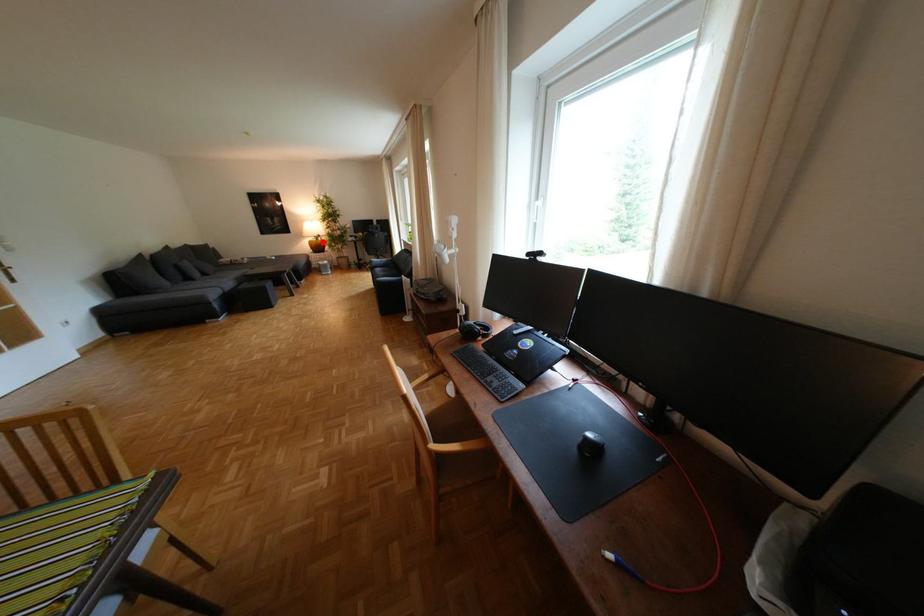
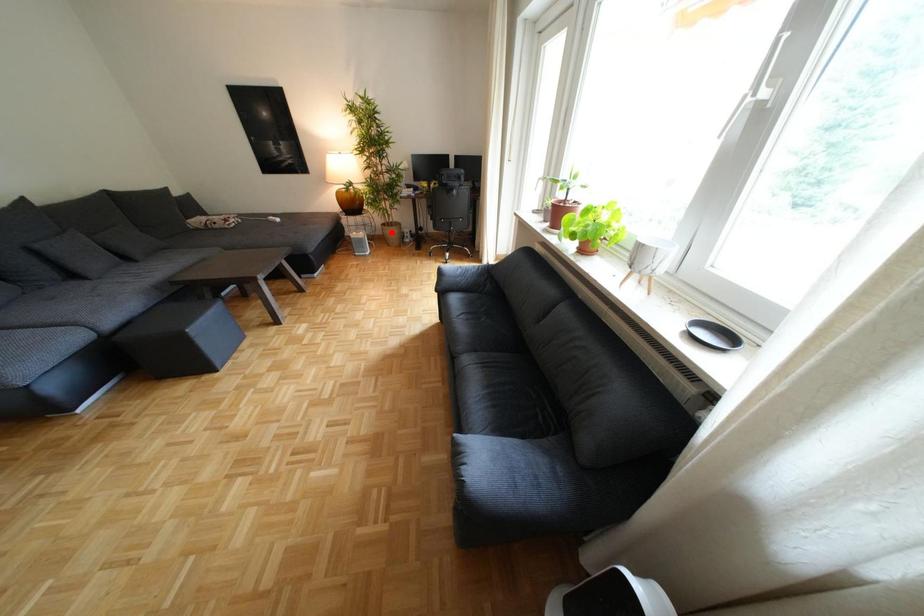
I am providing you with two images of the same scene from different viewpoints. A red point is marked on the first image and another point is marked on the second image. Do the highlighted points in image1 and image2 indicate the same real-world spot?

No